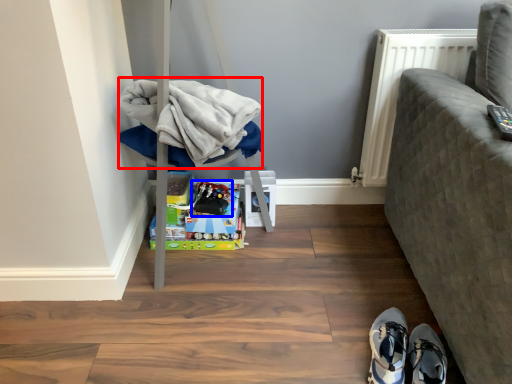
Question: Among these objects, which one is farthest to the camera, clothing (highlighted by a red box) or toy (highlighted by a blue box)?

Choices:
 (A) clothing
 (B) toy

Answer: (B)